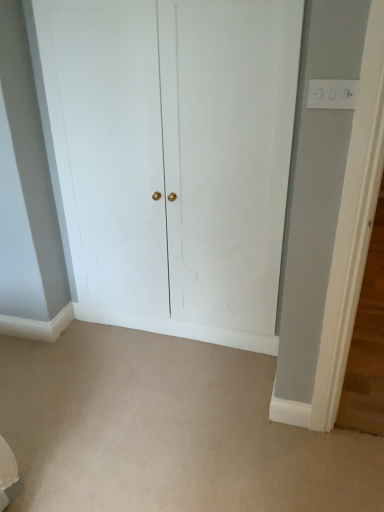
Question: Does white matte door at center have a lesser width compared to beige carpet at center?

Choices:
 (A) yes
 (B) no

Answer: (A)

Question: Is white matte door at center closer to camera compared to beige carpet at center?

Choices:
 (A) yes
 (B) no

Answer: (B)

Question: From a real-world perspective, does white matte door at center stand above beige carpet at center?

Choices:
 (A) yes
 (B) no

Answer: (A)

Question: Considering the relative sizes of white matte door at center and beige carpet at center in the image provided, is white matte door at center bigger than beige carpet at center?

Choices:
 (A) no
 (B) yes

Answer: (B)

Question: Is white matte door at center beside beige carpet at center?

Choices:
 (A) yes
 (B) no

Answer: (B)

Question: Considering the relative sizes of white matte door at center and beige carpet at center in the image provided, is white matte door at center shorter than beige carpet at center?

Choices:
 (A) yes
 (B) no

Answer: (B)

Question: From a real-world perspective, is beige carpet at center on top of white matte door at center?

Choices:
 (A) yes
 (B) no

Answer: (B)

Question: Is beige carpet at center thinner than white matte door at center?

Choices:
 (A) yes
 (B) no

Answer: (B)

Question: Can white matte door at center be found inside beige carpet at center?

Choices:
 (A) yes
 (B) no

Answer: (B)

Question: Does beige carpet at center appear on the left side of white matte door at center?

Choices:
 (A) no
 (B) yes

Answer: (B)

Question: Is beige carpet at center not close to white matte door at center?

Choices:
 (A) yes
 (B) no

Answer: (B)

Question: Is beige carpet at center oriented towards white matte door at center?

Choices:
 (A) yes
 (B) no

Answer: (B)

Question: From a real-world perspective, is white matte door at center physically located above or below beige carpet at center?

Choices:
 (A) below
 (B) above

Answer: (B)